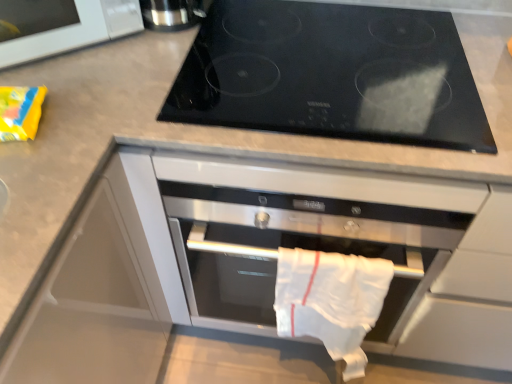
Question: Is white cotton towel at center beside black glass cooktop at upper center?

Choices:
 (A) no
 (B) yes

Answer: (A)

Question: From the image's perspective, does white cotton towel at center appear lower than black glass cooktop at upper center?

Choices:
 (A) no
 (B) yes

Answer: (B)

Question: Is white cotton towel at center smaller than black glass cooktop at upper center?

Choices:
 (A) no
 (B) yes

Answer: (B)

Question: Is the depth of white cotton towel at center greater than that of black glass cooktop at upper center?

Choices:
 (A) yes
 (B) no

Answer: (A)

Question: Is black glass cooktop at upper center completely or partially inside white cotton towel at center?

Choices:
 (A) yes
 (B) no

Answer: (B)

Question: From a real-world perspective, is white cotton towel at center physically below black glass cooktop at upper center?

Choices:
 (A) no
 (B) yes

Answer: (B)

Question: Is black glass cooktop at upper center not inside white glossy microwave at upper left?

Choices:
 (A) yes
 (B) no

Answer: (A)

Question: From a real-world perspective, is black glass cooktop at upper center located beneath white glossy microwave at upper left?

Choices:
 (A) no
 (B) yes

Answer: (B)

Question: Can you confirm if black glass cooktop at upper center is bigger than white glossy microwave at upper left?

Choices:
 (A) yes
 (B) no

Answer: (A)

Question: Is black glass cooktop at upper center smaller than white glossy microwave at upper left?

Choices:
 (A) yes
 (B) no

Answer: (B)

Question: Can you confirm if black glass cooktop at upper center is taller than white glossy microwave at upper left?

Choices:
 (A) yes
 (B) no

Answer: (B)

Question: Is black glass cooktop at upper center shorter than white glossy microwave at upper left?

Choices:
 (A) yes
 (B) no

Answer: (A)

Question: Are black glass cooktop at upper center and satin silver thermos at upper left located far from each other?

Choices:
 (A) no
 (B) yes

Answer: (A)